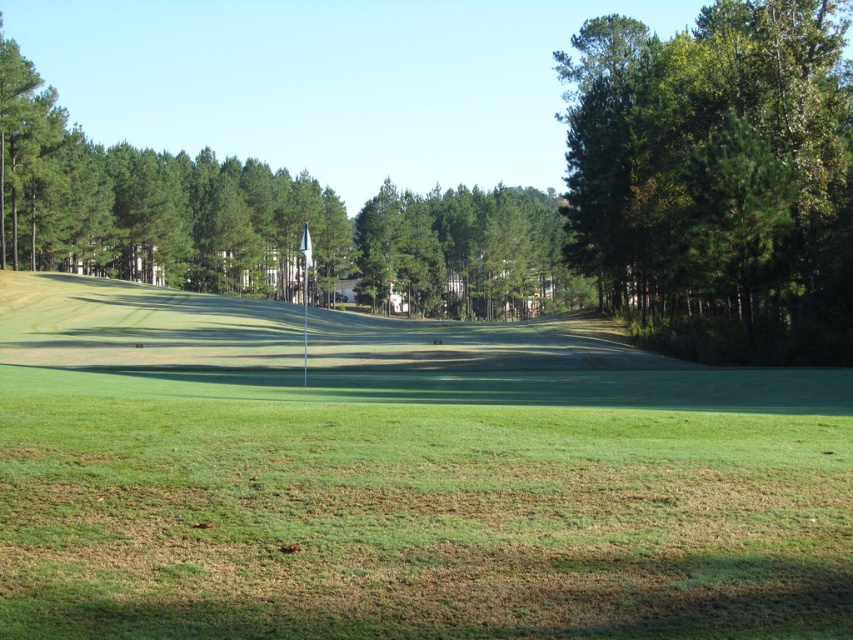
Question: In this image, where is green grass at center located relative to green leafy tree at upper right?

Choices:
 (A) left
 (B) right

Answer: (A)

Question: Among these points, which one is farthest from the camera?

Choices:
 (A) (688, 97)
 (B) (219, 374)

Answer: (A)

Question: Considering the relative positions of green grass at center and green leafy tree at upper right in the image provided, where is green grass at center located with respect to green leafy tree at upper right?

Choices:
 (A) right
 (B) left

Answer: (B)

Question: Is green grass at center to the right of green leafy tree at upper right from the viewer's perspective?

Choices:
 (A) yes
 (B) no

Answer: (B)

Question: Which point appears farthest from the camera in this image?

Choices:
 (A) (843, 10)
 (B) (637, 586)

Answer: (A)